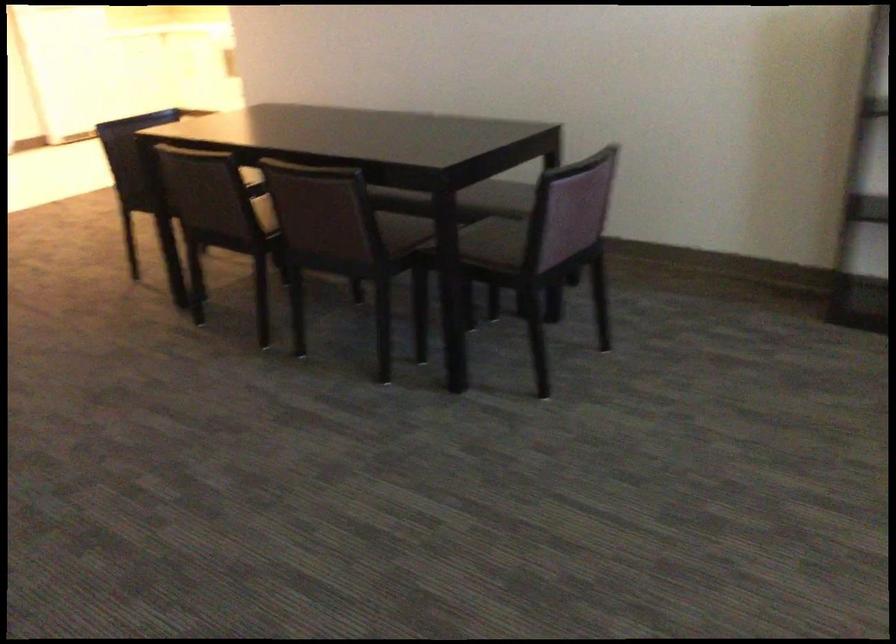
This screenshot has width=896, height=644. What do you see at coordinates (494, 242) in the screenshot? I see `the purple chair sitting surface` at bounding box center [494, 242].